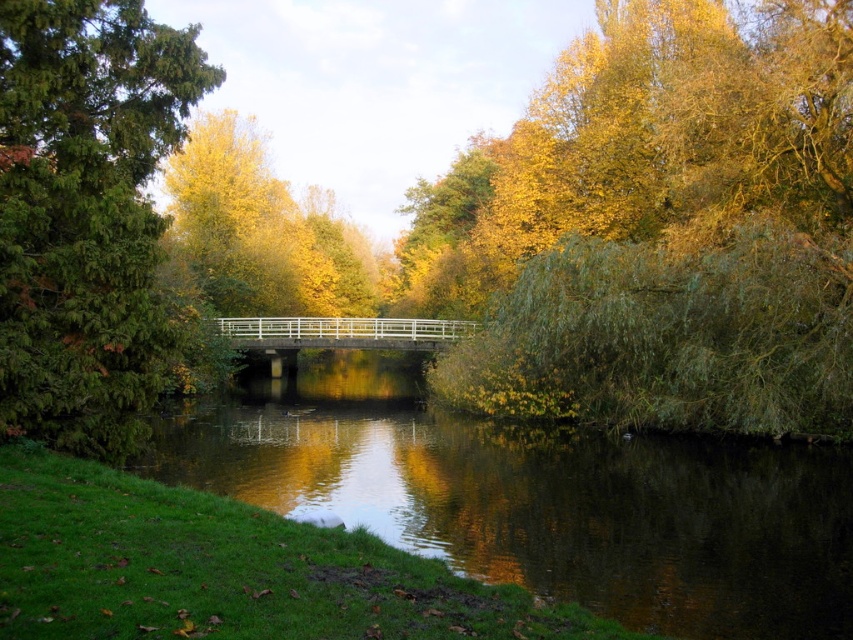
Can you confirm if golden textured leaves at right is smaller than green coniferous tree at left?

No, golden textured leaves at right is not smaller than green coniferous tree at left.

Is golden textured leaves at right wider than green coniferous tree at left?

Yes.

Is point (788, 360) positioned before point (19, 97)?

No, it is behind (19, 97).

Locate an element on the screen. golden textured leaves at right is located at coordinates [x=660, y=227].

Between golden textured leaves at right and green reflective water at center, which one is positioned higher?

golden textured leaves at right

Does golden textured leaves at right have a smaller size compared to green reflective water at center?

Incorrect, golden textured leaves at right is not smaller in size than green reflective water at center.

Who is more distant from viewer, (x=770, y=28) or (x=592, y=573)?

The point (x=770, y=28) is behind.

The width and height of the screenshot is (853, 640). What are the coordinates of `golden textured leaves at right` in the screenshot? It's located at (660, 227).

Is point (467, 540) in front of point (61, 26)?

Yes.

Does green reflective water at center have a greater height compared to green coniferous tree at left?

Incorrect, green reflective water at center's height is not larger of green coniferous tree at left's.

I want to click on green reflective water at center, so click(537, 497).